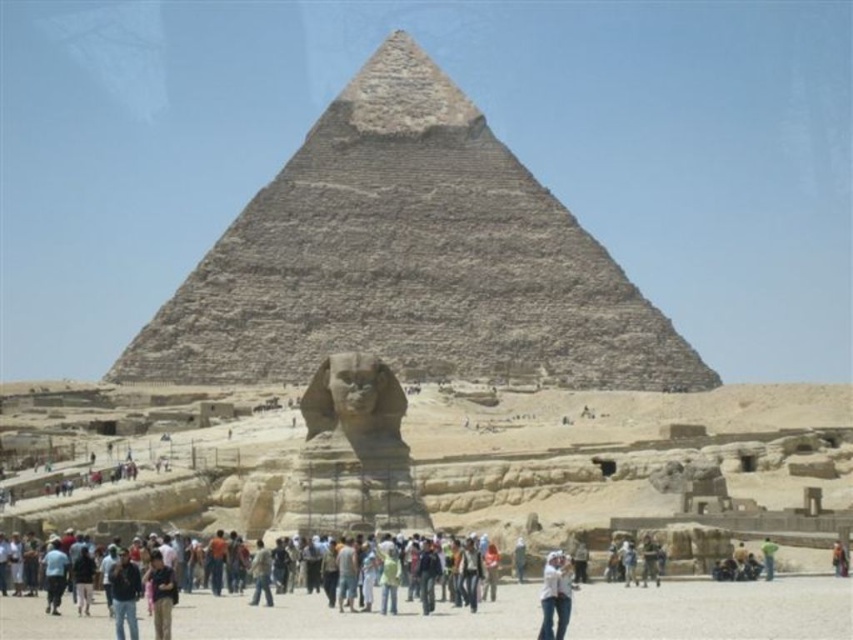
Does granite pyramid at center come behind dark blue shirt at lower left?

Yes, it is behind dark blue shirt at lower left.

Is granite pyramid at center shorter than dark blue shirt at lower left?

Incorrect, granite pyramid at center's height does not fall short of dark blue shirt at lower left's.

Describe the element at coordinates (409, 260) in the screenshot. Image resolution: width=853 pixels, height=640 pixels. I see `granite pyramid at center` at that location.

Locate an element on the screen. This screenshot has width=853, height=640. granite pyramid at center is located at coordinates (409, 260).